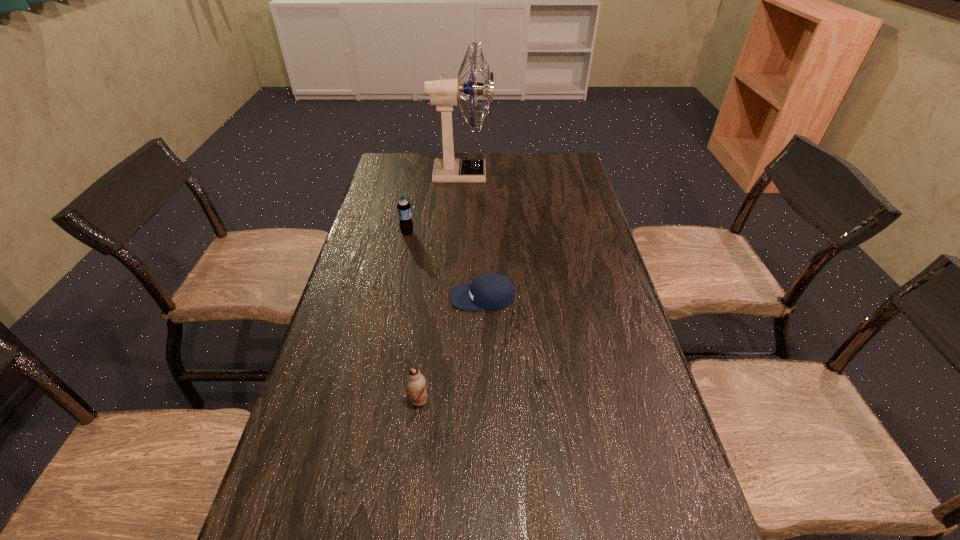
Locate which object is the closest to the baseball cap. Please provide its 2D coordinates. Your answer should be formatted as a tuple, i.e. [(x, y)], where the tuple contains the x and y coordinates of a point satisfying the conditions above.

[(416, 383)]

Locate which object ranks in proximity to the chocolate milk. Please provide its 2D coordinates. Your answer should be formatted as a tuple, i.e. [(x, y)], where the tuple contains the x and y coordinates of a point satisfying the conditions above.

[(492, 291)]